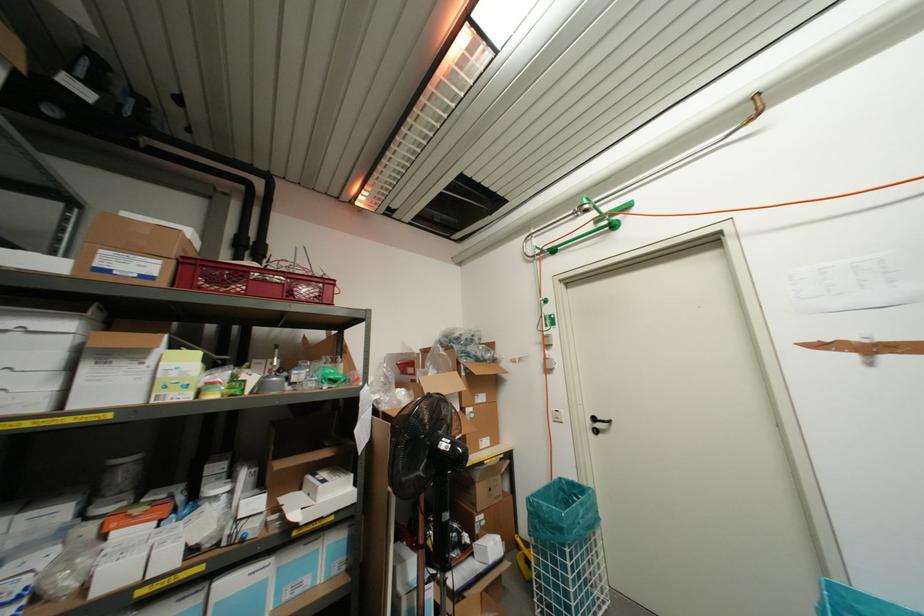
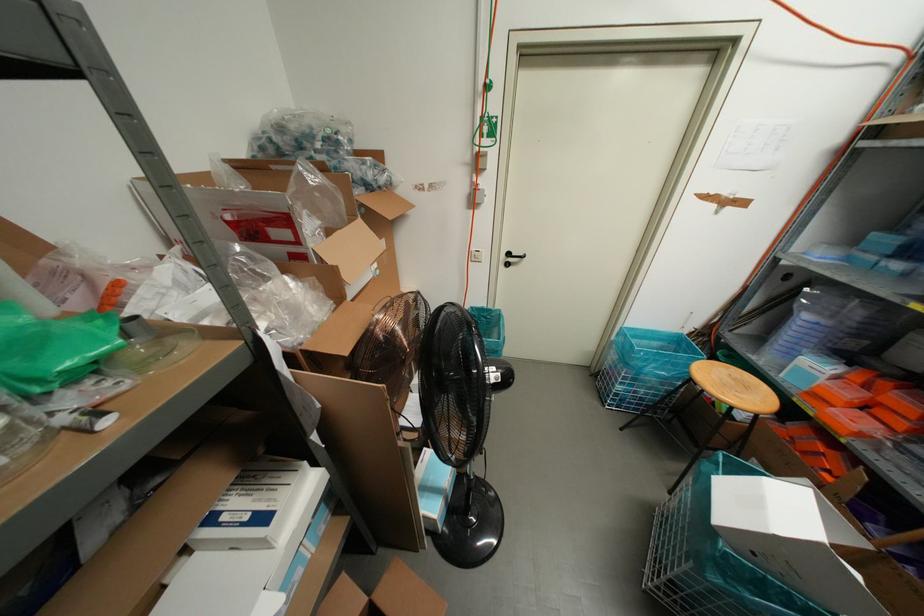
Where in the second image is the point corresponding to (551,416) from the first image?

(470, 257)